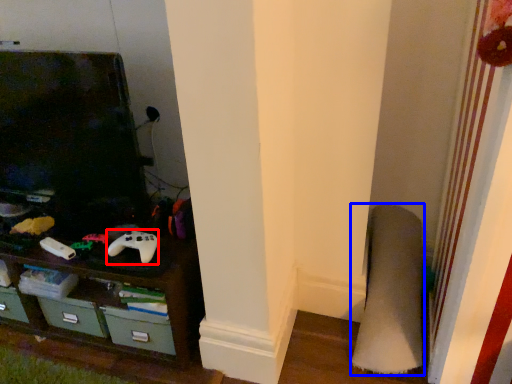
Question: Which point is closer to the camera, game controller (highlighted by a red box) or plain (highlighted by a blue box)?

Choices:
 (A) game controller
 (B) plain

Answer: (B)